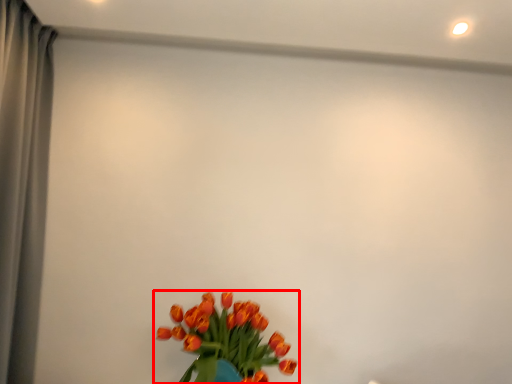
Question: From the image, what is the correct spatial relationship of flower (annotated by the red box) in relation to curtain?

Choices:
 (A) left
 (B) right

Answer: (B)